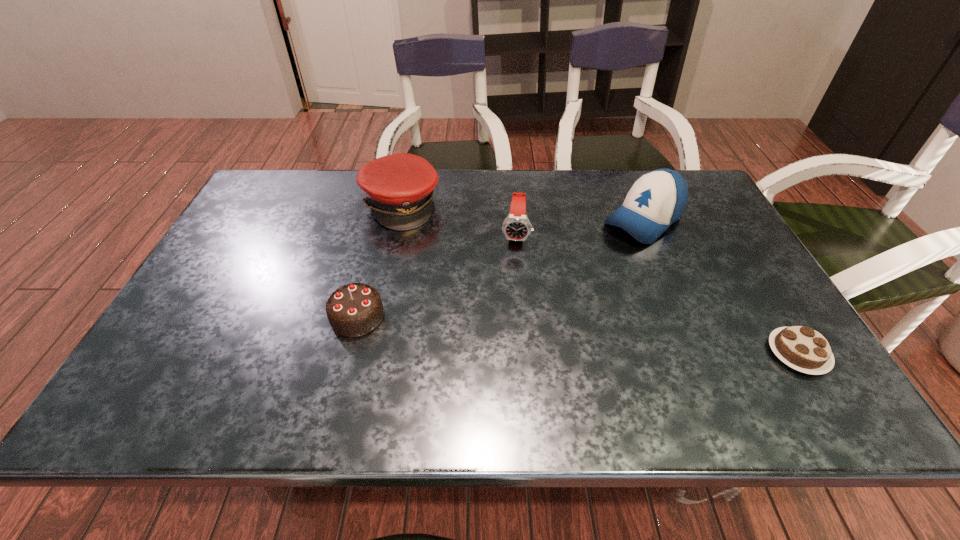
Identify the location of vacant region located on the face of the watch. (509, 330).

You are a GUI agent. You are given a task and a screenshot of the screen. Output one action in this format:
    pyautogui.click(x=<x>, y=<y>)
    Task: Click on the free space located 0.050m on the face of the watch
    This screenshot has width=960, height=540.
    Given the screenshot: What is the action you would take?
    pyautogui.click(x=515, y=262)

Where is `blank area located on the front of the cap with an emblem`? This screenshot has width=960, height=540. blank area located on the front of the cap with an emblem is located at coordinates (500, 302).

Image resolution: width=960 pixels, height=540 pixels. I want to click on vacant space located on the front of the cap with an emblem, so point(500,302).

I want to click on vacant space located 0.170m on the front of the cap with an emblem, so click(454, 258).

The image size is (960, 540). What are the coordinates of `vacant space located 0.370m on the front-facing side of the second object from right to left` in the screenshot? It's located at (532, 308).

You are a GUI agent. You are given a task and a screenshot of the screen. Output one action in this format:
    pyautogui.click(x=<x>, y=<y>)
    Task: Click on the vacant area situated on the front-facing side of the second object from right to left
    This screenshot has width=960, height=540.
    Given the screenshot: What is the action you would take?
    pyautogui.click(x=583, y=268)

At what (x,y) coordinates should I click in order to perform the action: click on free location located 0.090m on the front-facing side of the second object from right to left. Please return your answer as a coordinate pair (x, y). Looking at the image, I should click on (600, 254).

This screenshot has height=540, width=960. I want to click on cap located in the far edge section of the desktop, so click(399, 188).

This screenshot has width=960, height=540. I want to click on baseball cap that is at the far edge, so click(x=657, y=199).